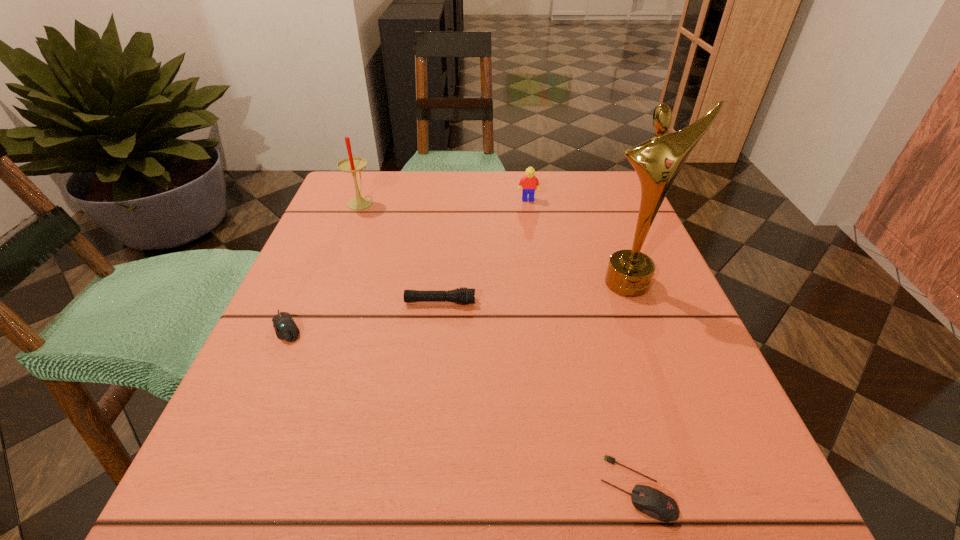
The width and height of the screenshot is (960, 540). In order to click on free space located on the front-facing side of the tallest object in this screenshot , I will do `click(720, 527)`.

At what (x,y) coordinates should I click in order to perform the action: click on vacant position located on the right of the candle. Please return your answer as a coordinate pair (x, y). This screenshot has width=960, height=540. Looking at the image, I should click on (481, 202).

This screenshot has height=540, width=960. What are the coordinates of `vacant space located 0.230m on the front-facing side of the fourth shortest object` in the screenshot? It's located at (538, 264).

Identify the location of blank area located 0.310m at the lens end of the fourth object from right to left. [x=649, y=302].

At what (x,y) coordinates should I click in order to perform the action: click on vacant region located 0.220m on the front of the fifth farthest object. Please return your answer as a coordinate pair (x, y). The width and height of the screenshot is (960, 540). Looking at the image, I should click on (220, 480).

Where is `vacant space situated on the left of the nearest object`? The height and width of the screenshot is (540, 960). vacant space situated on the left of the nearest object is located at coordinates (324, 488).

Locate an element on the screen. candle at the far edge is located at coordinates (352, 164).

At what (x,y) coordinates should I click in order to perform the action: click on Lego present at the far edge. Please return your answer as a coordinate pair (x, y). This screenshot has height=540, width=960. Looking at the image, I should click on (528, 184).

Image resolution: width=960 pixels, height=540 pixels. In order to click on object situated at the near edge in this screenshot , I will do `click(650, 501)`.

This screenshot has width=960, height=540. Identify the location of candle located at the left edge. (352, 164).